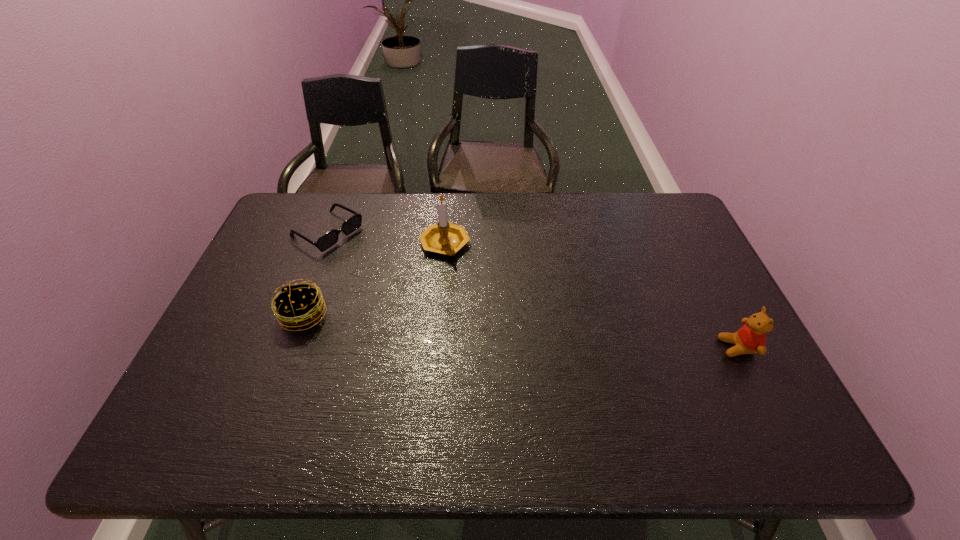
The height and width of the screenshot is (540, 960). Identify the location of vacant space on the desktop that is between the patty and the rightmost object and is positioned with a handle on the tallest object. (559, 334).

Where is `free space on the desktop that is between the patty and the teddy bear and is positioned on the front-facing side of the sunglasses`? This screenshot has width=960, height=540. free space on the desktop that is between the patty and the teddy bear and is positioned on the front-facing side of the sunglasses is located at coordinates (499, 330).